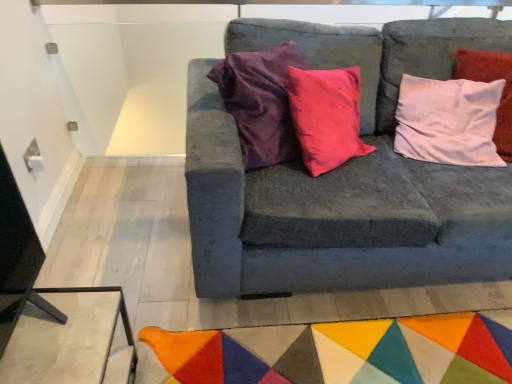
Question: Is velvet gray couch at center to the left or to the right of multicolored felt mat at lower center in the image?

Choices:
 (A) right
 (B) left

Answer: (A)

Question: In terms of width, does velvet gray couch at center look wider or thinner when compared to multicolored felt mat at lower center?

Choices:
 (A) thin
 (B) wide

Answer: (A)

Question: Is velvet gray couch at center in front of or behind multicolored felt mat at lower center in the image?

Choices:
 (A) front
 (B) behind

Answer: (A)

Question: Does point (478, 350) appear closer or farther from the camera than point (372, 79)?

Choices:
 (A) closer
 (B) farther

Answer: (A)

Question: From the image's perspective, relative to velvet gray couch at center, is multicolored felt mat at lower center above or below?

Choices:
 (A) above
 (B) below

Answer: (B)

Question: Is multicolored felt mat at lower center taller or shorter than velvet gray couch at center?

Choices:
 (A) short
 (B) tall

Answer: (A)

Question: Is multicolored felt mat at lower center spatially inside velvet gray couch at center, or outside of it?

Choices:
 (A) inside
 (B) outside

Answer: (B)